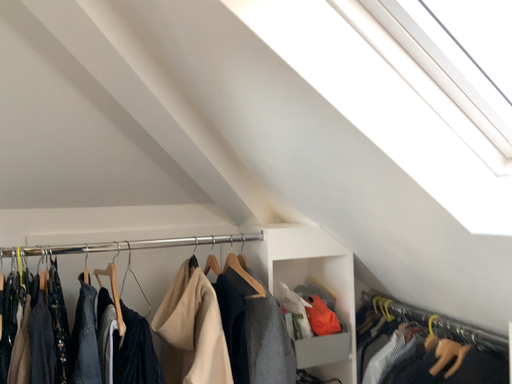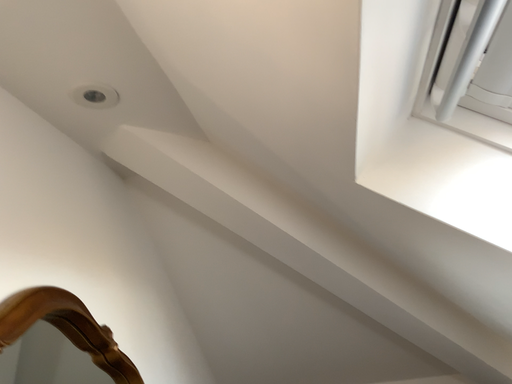
Question: Which way did the camera rotate in the video?

Choices:
 (A) rotated left
 (B) rotated right

Answer: (A)